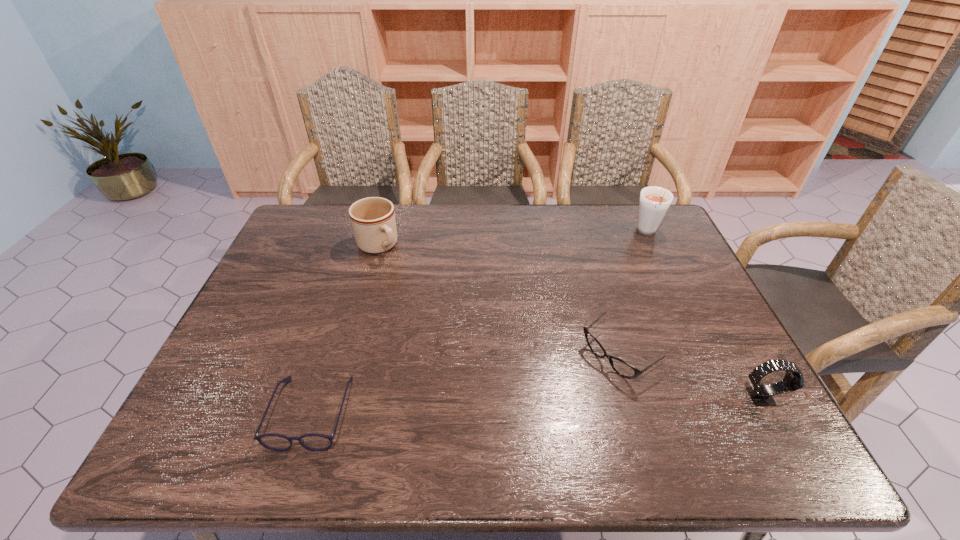
Locate an element on the screen. This screenshot has width=960, height=540. free region that satisfies the following two spatial constraints: 1. on the front side of the root beer; 2. on the face of the watch is located at coordinates (725, 396).